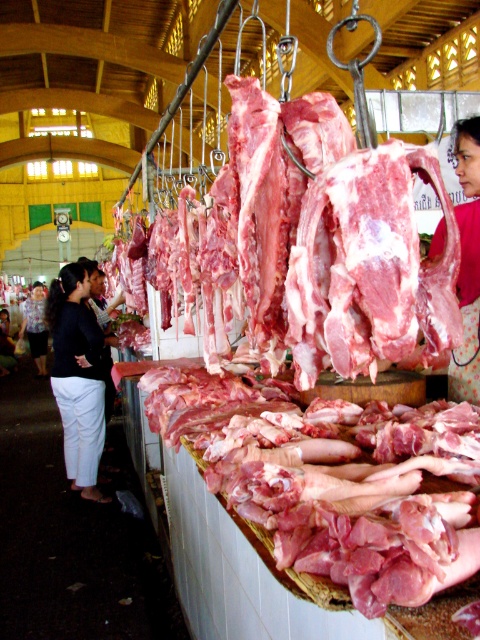
Is black cotton pants at lower left thinner than matte pink fabric at center?

No.

Find the location of a particular element. The width and height of the screenshot is (480, 640). black cotton pants at lower left is located at coordinates (78, 378).

At what (x,y) coordinates should I click in order to perform the action: click on black cotton pants at lower left. Please return your answer as a coordinate pair (x, y). Looking at the image, I should click on (78, 378).